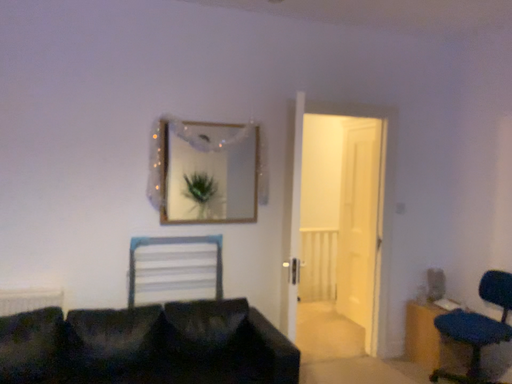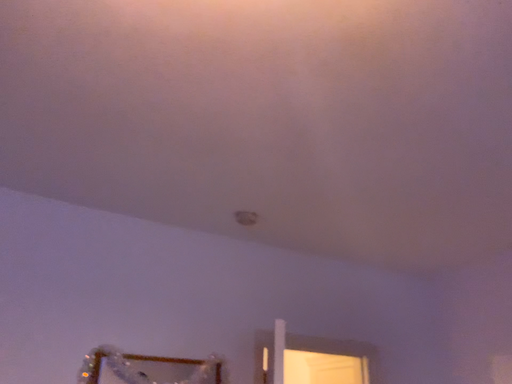
Question: Which way did the camera rotate in the video?

Choices:
 (A) rotated left
 (B) rotated right

Answer: (B)